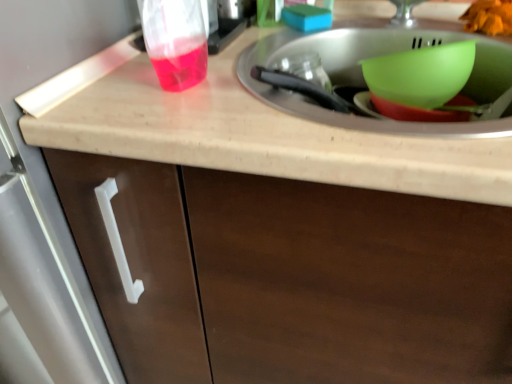
What do you see at coordinates (364, 80) in the screenshot? The image size is (512, 384). I see `matte plastic sink at center` at bounding box center [364, 80].

What is the approximate width of orange matte food at upper right?

orange matte food at upper right is 5.33 inches wide.

Locate an element on the screen. The image size is (512, 384). green plastic bowl at upper right is located at coordinates (421, 74).

Is transparent plastic cup at upper left looking in the opposite direction of matte plastic sink at center?

No, transparent plastic cup at upper left is not facing away from matte plastic sink at center.

From their relative heights in the image, would you say transparent plastic cup at upper left is taller or shorter than matte plastic sink at center?

In the image, transparent plastic cup at upper left appears to be taller than matte plastic sink at center.

Considering the positions of objects transparent plastic cup at upper left and matte plastic sink at center in the image provided, who is in front, transparent plastic cup at upper left or matte plastic sink at center?

matte plastic sink at center is closer to the camera.

From a real-world perspective, is beige matte countertop at upper center on top of orange matte food at upper right?

No.

Considering the sizes of objects beige matte countertop at upper center and orange matte food at upper right in the image provided, who is wider, beige matte countertop at upper center or orange matte food at upper right?

Wider between the two is beige matte countertop at upper center.

Looking at this image, from the image's perspective, who appears lower, beige matte countertop at upper center or orange matte food at upper right?

beige matte countertop at upper center is shown below in the image.

Which is in front, point (69, 115) or point (460, 18)?

Positioned in front is point (69, 115).

Can you tell me how much brown matte cabinet at center and matte plastic sink at center differ in facing direction?

brown matte cabinet at center and matte plastic sink at center are facing 1.58 degrees away from each other.

Considering the sizes of brown matte cabinet at center and matte plastic sink at center in the image, is brown matte cabinet at center taller or shorter than matte plastic sink at center?

Considering their sizes, brown matte cabinet at center has more height than matte plastic sink at center.

Considering the relative sizes of brown matte cabinet at center and matte plastic sink at center in the image provided, is brown matte cabinet at center thinner than matte plastic sink at center?

Incorrect, the width of brown matte cabinet at center is not less than that of matte plastic sink at center.

Does brown matte cabinet at center lie behind matte plastic sink at center?

No, the depth of brown matte cabinet at center is less than that of matte plastic sink at center.

From a real-world perspective, is green plastic bowl at upper right located beneath brown matte cabinet at center?

Actually, green plastic bowl at upper right is physically above brown matte cabinet at center in the real world.

Is green plastic bowl at upper right in front of or behind brown matte cabinet at center in the image?

green plastic bowl at upper right is behind brown matte cabinet at center.

Based on the photo, would you consider green plastic bowl at upper right to be distant from brown matte cabinet at center?

No, there isn't a large distance between green plastic bowl at upper right and brown matte cabinet at center.

From their relative heights in the image, would you say green plastic bowl at upper right is taller or shorter than brown matte cabinet at center?

green plastic bowl at upper right is shorter than brown matte cabinet at center.

From the image's perspective, which one is positioned higher, beige matte countertop at upper center or transparent plastic cup at upper left?

transparent plastic cup at upper left appears higher in the image.

From a real-world perspective, is beige matte countertop at upper center over transparent plastic cup at upper left?

No, from a real-world perspective, beige matte countertop at upper center is not above transparent plastic cup at upper left.

Who is smaller, beige matte countertop at upper center or transparent plastic cup at upper left?

Smaller between the two is transparent plastic cup at upper left.

What's the angular difference between beige matte countertop at upper center and transparent plastic cup at upper left's facing directions?

The facing directions of beige matte countertop at upper center and transparent plastic cup at upper left are 0.00344 degrees apart.

From the image's perspective, which is below, matte plastic sink at center or beige matte countertop at upper center?

From the image's view, beige matte countertop at upper center is below.

Looking at this image, is matte plastic sink at center behind beige matte countertop at upper center?

Yes, matte plastic sink at center is further from the viewer.

I want to click on sink located on the left of beige matte countertop at upper center, so pyautogui.click(x=364, y=80).

Where is `appliance that appears above the green plastic bowl at upper right (from a real-world perspective)`? appliance that appears above the green plastic bowl at upper right (from a real-world perspective) is located at coordinates (225, 34).

Is transparent plastic cup at upper left in front of or behind green plastic bowl at upper right in the image?

In the image, transparent plastic cup at upper left appears in front of green plastic bowl at upper right.

Is transparent plastic cup at upper left outside of green plastic bowl at upper right?

Yes.

Is there a large distance between transparent plastic cup at upper left and green plastic bowl at upper right?

No.

Where is `sink below the transparent plastic cup at upper left (from a real-world perspective)`? sink below the transparent plastic cup at upper left (from a real-world perspective) is located at coordinates (364, 80).

The height and width of the screenshot is (384, 512). Find the location of `food to the right of beige matte countertop at upper center`. food to the right of beige matte countertop at upper center is located at coordinates (489, 17).

Which object lies nearer to the anchor point transparent plastic cup at upper left, matte plastic sink at center or green plastic bowl at upper right?

Based on the image, matte plastic sink at center appears to be nearer to transparent plastic cup at upper left.

Considering their positions, is beige matte countertop at upper center positioned closer to orange matte food at upper right than green plastic bowl at upper right?

Based on the image, green plastic bowl at upper right appears to be nearer to orange matte food at upper right.

Considering their positions, is green plastic bowl at upper right positioned closer to brown matte cabinet at center than matte plastic sink at center?

matte plastic sink at center lies closer to brown matte cabinet at center than the other object.

Considering their positions, is beige matte countertop at upper center positioned closer to transparent plastic cup at upper left than matte plastic sink at center?

matte plastic sink at center is positioned closer to the anchor transparent plastic cup at upper left.

Based on their spatial positions, is matte plastic sink at center or brown matte cabinet at center closer to transparent plastic cup at upper left?

The object closer to transparent plastic cup at upper left is matte plastic sink at center.

From the image, which object appears to be farther from brown matte cabinet at center, orange matte food at upper right or beige matte countertop at upper center?

orange matte food at upper right.

In the scene shown: Looking at the image, which one is located further to matte plastic sink at center, beige matte countertop at upper center or green plastic bowl at upper right?

beige matte countertop at upper center is further to matte plastic sink at center.

Which object lies further to the anchor point transparent plastic cup at upper left, brown matte cabinet at center or matte plastic sink at center?

Among the two, brown matte cabinet at center is located further to transparent plastic cup at upper left.

This screenshot has height=384, width=512. I want to click on sink between transparent plastic cup at upper left and brown matte cabinet at center from top to bottom, so click(x=364, y=80).

Where is `countertop between transparent plastic cup at upper left and green plastic bowl at upper right`? The height and width of the screenshot is (384, 512). countertop between transparent plastic cup at upper left and green plastic bowl at upper right is located at coordinates (246, 131).

Identify the location of countertop that lies between orange matte food at upper right and brown matte cabinet at center from top to bottom. (246, 131).

Image resolution: width=512 pixels, height=384 pixels. I want to click on basin between orange matte food at upper right and brown matte cabinet at center in the up-down direction, so click(421, 74).